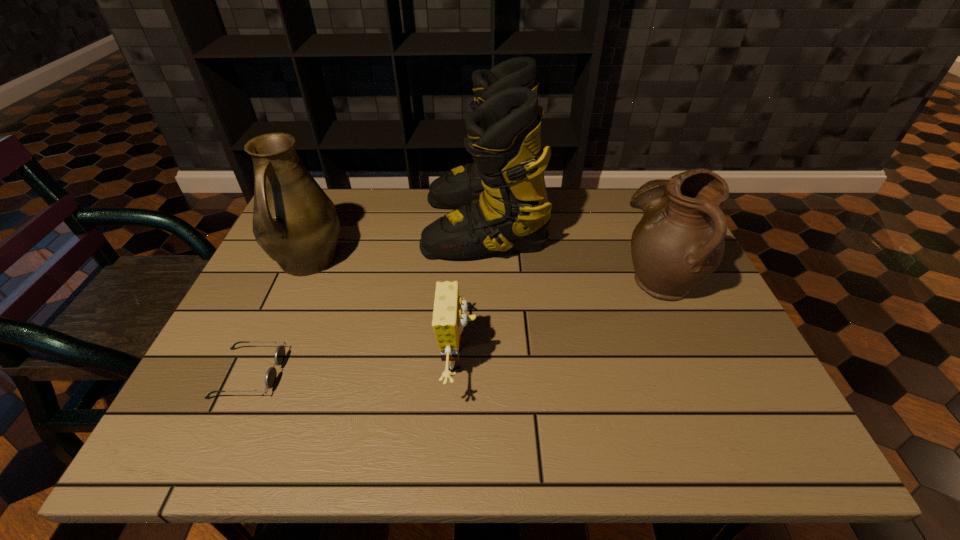
At what (x,y) coordinates should I click in order to perform the action: click on the tallest object. Please return your answer as a coordinate pair (x, y). The width and height of the screenshot is (960, 540). Looking at the image, I should click on (501, 201).

The image size is (960, 540). Find the location of `the left pitcher`. the left pitcher is located at coordinates (294, 221).

In order to click on the right pitcher in this screenshot , I will do `click(679, 242)`.

Where is `the fourth tallest object`? This screenshot has height=540, width=960. the fourth tallest object is located at coordinates (449, 315).

Locate an element on the screen. Image resolution: width=960 pixels, height=540 pixels. sunglasses is located at coordinates (270, 378).

I want to click on vacant space located 0.090m on the right of the ski boots, so click(x=575, y=224).

Find the location of a particular element. The width and height of the screenshot is (960, 540). free location located 0.090m on the handle side of the left pitcher is located at coordinates (282, 319).

Find the location of `free space located at the spout of the rightmost object`. free space located at the spout of the rightmost object is located at coordinates (574, 278).

What are the coordinates of `vacant area situated at the spout of the rightmost object` in the screenshot? It's located at (504, 278).

I want to click on free space located at the spout of the rightmost object, so click(562, 278).